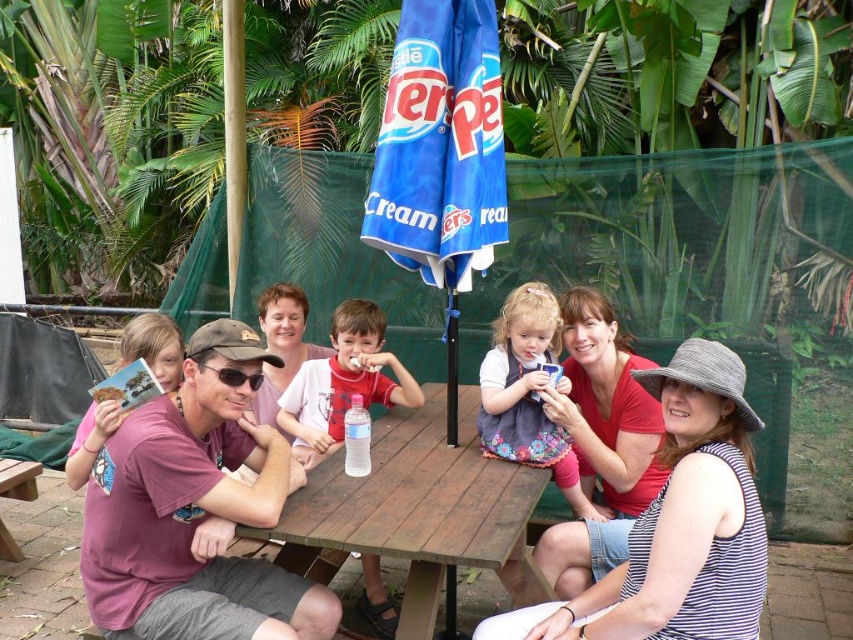
Question: Which object is closer to the camera taking this photo?

Choices:
 (A) red shirt boy at center
 (B) maroon t-shirt at center

Answer: (B)

Question: Is matte pink shirt at center further to the viewer compared to floral dress at center?

Choices:
 (A) yes
 (B) no

Answer: (B)

Question: Which is nearer to the matte pink shirt at center?

Choices:
 (A) maroon t-shirt at center
 (B) matte red shirt at center

Answer: (B)

Question: Is maroon t-shirt at center positioned before floral dress at center?

Choices:
 (A) no
 (B) yes

Answer: (B)

Question: Is wooden table at center positioned in front of floral dress at center?

Choices:
 (A) yes
 (B) no

Answer: (A)

Question: Which of the following is the closest to the observer?

Choices:
 (A) floral dress at center
 (B) wooden table at center
 (C) red shirt boy at center
 (D) maroon t-shirt at center

Answer: (B)